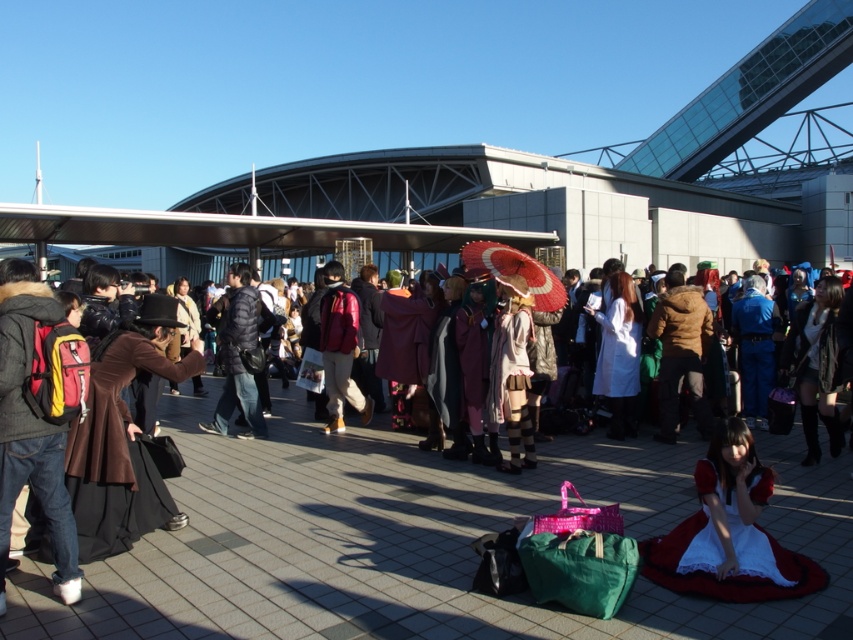
Who is more forward, (x=688, y=513) or (x=9, y=387)?

Point (x=9, y=387) is more forward.

Is brown leather coat at center bigger than matte red backpack at left?

Indeed, brown leather coat at center has a larger size compared to matte red backpack at left.

Is point (442, 616) farther from camera compared to point (4, 528)?

Yes, point (442, 616) is farther from viewer.

The width and height of the screenshot is (853, 640). I want to click on brown leather coat at center, so click(x=413, y=540).

Is white satin dress at lower right to the left of matte red backpack at left from the viewer's perspective?

Incorrect, white satin dress at lower right is not on the left side of matte red backpack at left.

Does point (729, 435) lie behind point (30, 282)?

No, (729, 435) is closer to viewer.

Is point (717, 547) positioned before point (38, 440)?

No, (717, 547) is further to viewer.

Find the location of a particular element. The image size is (853, 640). white satin dress at lower right is located at coordinates (729, 532).

Can you confirm if brown leather coat at center is shorter than white satin dress at lower right?

No.

Between point (38, 582) and point (700, 582), which one is positioned in front?

Positioned in front is point (700, 582).

The height and width of the screenshot is (640, 853). What are the coordinates of `brown leather coat at center` in the screenshot? It's located at (413, 540).